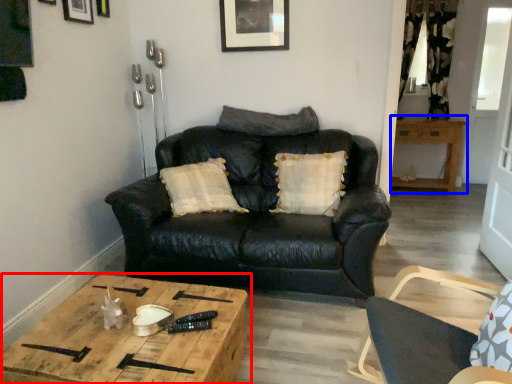
Question: Which object appears farthest to the camera in this image, table (highlighted by a red box) or table (highlighted by a blue box)?

Choices:
 (A) table
 (B) table

Answer: (B)